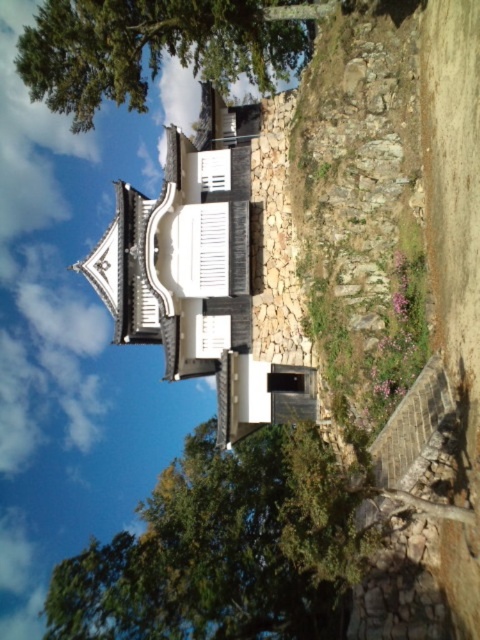
Is the position of green leafy tree at lower center more distant than that of green leafy tree at upper left?

No, green leafy tree at lower center is in front of green leafy tree at upper left.

Does green leafy tree at lower center have a smaller size compared to green leafy tree at upper left?

Incorrect, green leafy tree at lower center is not smaller in size than green leafy tree at upper left.

What do you see at coordinates (225, 548) in the screenshot? This screenshot has width=480, height=640. I see `green leafy tree at lower center` at bounding box center [225, 548].

Locate an element on the screen. The width and height of the screenshot is (480, 640). green leafy tree at lower center is located at coordinates (225, 548).

Between green leafy tree at lower center and white matte shutter at center, which one appears on the left side from the viewer's perspective?

green leafy tree at lower center

Is point (255, 502) positioned behind point (210, 241)?

Yes, it is behind point (210, 241).

Does point (260, 461) come behind point (211, 228)?

Yes, it is.

Identify the location of green leafy tree at lower center. (225, 548).

Can you confirm if green leafy tree at upper left is wider than white matte shutter at center?

Yes, green leafy tree at upper left is wider than white matte shutter at center.

Is green leafy tree at upper left shorter than white matte shutter at center?

Incorrect, green leafy tree at upper left's height does not fall short of white matte shutter at center's.

Does point (203, 64) lie behind point (226, 289)?

Yes, it is behind point (226, 289).

This screenshot has width=480, height=640. I want to click on green leafy tree at upper left, so click(157, 48).